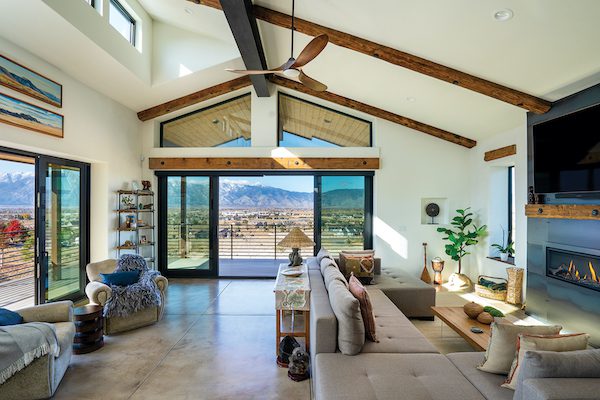
You are a GUI agent. You are given a task and a screenshot of the screen. Output one action in this format:
    pyautogui.click(x=<x>, y=<y>)
    Task: Click on the plant in the corner on the right
    The width and height of the screenshot is (600, 400).
    Given the screenshot: What is the action you would take?
    pyautogui.click(x=456, y=238)